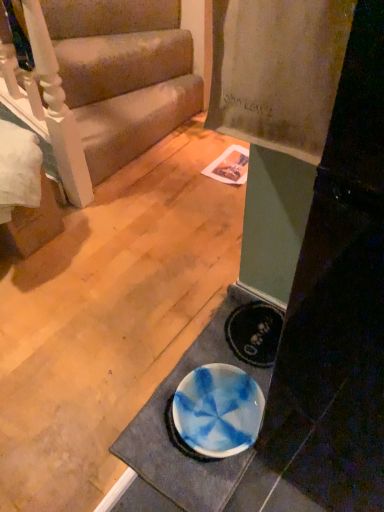
Question: Does white glossy doormat at lower center appear on the left side of beige fabric couch at upper left?

Choices:
 (A) no
 (B) yes

Answer: (A)

Question: Is white glossy doormat at lower center touching beige fabric couch at upper left?

Choices:
 (A) yes
 (B) no

Answer: (B)

Question: Considering the relative sizes of white glossy doormat at lower center and beige fabric couch at upper left in the image provided, is white glossy doormat at lower center bigger than beige fabric couch at upper left?

Choices:
 (A) yes
 (B) no

Answer: (B)

Question: Is the position of white glossy doormat at lower center more distant than that of beige fabric couch at upper left?

Choices:
 (A) no
 (B) yes

Answer: (A)

Question: Considering the relative sizes of white glossy doormat at lower center and beige fabric couch at upper left in the image provided, is white glossy doormat at lower center thinner than beige fabric couch at upper left?

Choices:
 (A) yes
 (B) no

Answer: (A)

Question: Can you confirm if white glossy doormat at lower center is wider than beige fabric couch at upper left?

Choices:
 (A) no
 (B) yes

Answer: (A)

Question: Considering the relative sizes of beige fabric couch at upper left and white glossy doormat at lower center in the image provided, is beige fabric couch at upper left wider than white glossy doormat at lower center?

Choices:
 (A) no
 (B) yes

Answer: (B)

Question: Does beige fabric couch at upper left touch white glossy doormat at lower center?

Choices:
 (A) no
 (B) yes

Answer: (A)

Question: From a real-world perspective, is beige fabric couch at upper left positioned under white glossy doormat at lower center based on gravity?

Choices:
 (A) no
 (B) yes

Answer: (A)

Question: From the image's perspective, is beige fabric couch at upper left under white glossy doormat at lower center?

Choices:
 (A) no
 (B) yes

Answer: (A)

Question: Is beige fabric couch at upper left not inside white glossy doormat at lower center?

Choices:
 (A) no
 (B) yes

Answer: (B)

Question: Considering the relative sizes of beige fabric couch at upper left and white glossy doormat at lower center in the image provided, is beige fabric couch at upper left bigger than white glossy doormat at lower center?

Choices:
 (A) yes
 (B) no

Answer: (A)

Question: Considering the positions of point (190, 506) and point (167, 57), is point (190, 506) closer or farther from the camera than point (167, 57)?

Choices:
 (A) closer
 (B) farther

Answer: (A)